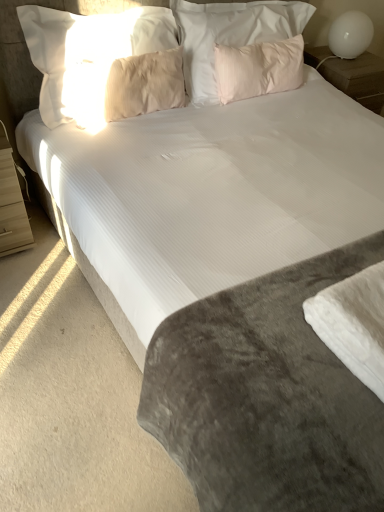
This screenshot has width=384, height=512. Find the location of `vacant position to the left of white soft fabric at lower right`. vacant position to the left of white soft fabric at lower right is located at coordinates (273, 331).